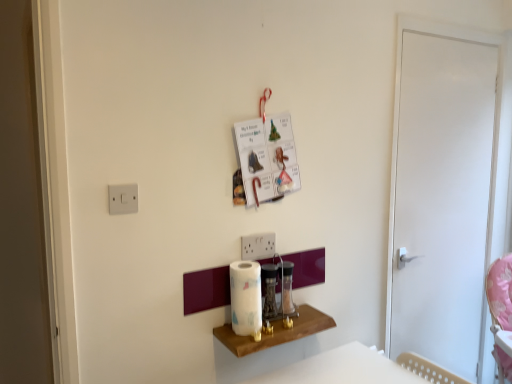
Locate an element on the screen. free point to the right of metallic silver blender at center, placed as the first appliance when sorted from left to right is located at coordinates (304, 317).